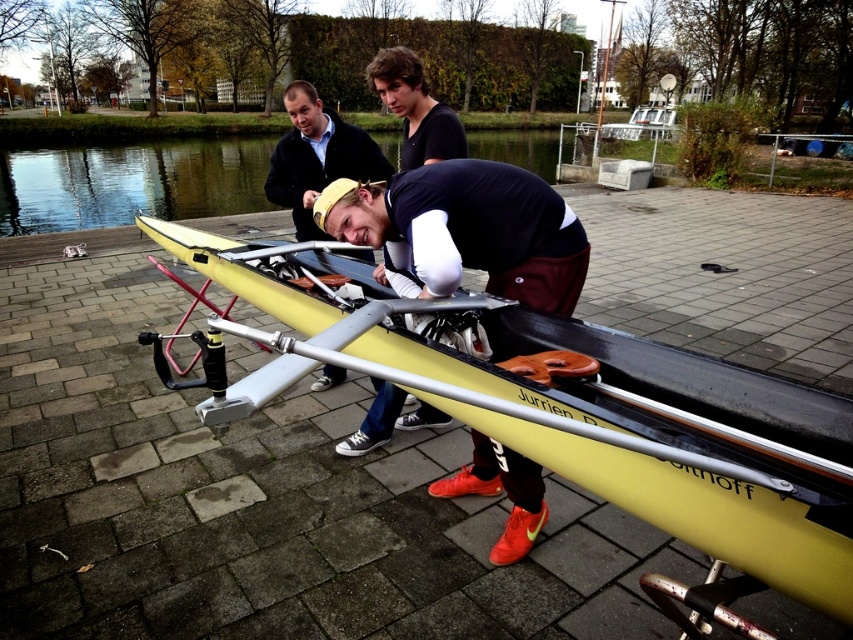
Consider the image. Which is below, matte black rowing boat at center or clear water at center?

matte black rowing boat at center is below.

Which is in front, point (537, 246) or point (183, 156)?

Point (537, 246)

Where is `matte black rowing boat at center`? The width and height of the screenshot is (853, 640). matte black rowing boat at center is located at coordinates (463, 230).

Who is positioned more to the left, yellow matte boat at center or matte black rowing boat at center?

From the viewer's perspective, yellow matte boat at center appears more on the left side.

Measure the distance between point [659,388] and camera.

Point [659,388] is 2.12 meters away from camera.

Identify the location of yellow matte boat at center. (601, 413).

Which of these two, yellow matte boat at center or clear water at center, stands shorter?

yellow matte boat at center

Is yellow matte boat at center further to camera compared to clear water at center?

No.

Locate an element on the screen. The image size is (853, 640). yellow matte boat at center is located at coordinates (601, 413).

Identify the location of yellow matte boat at center. (601, 413).